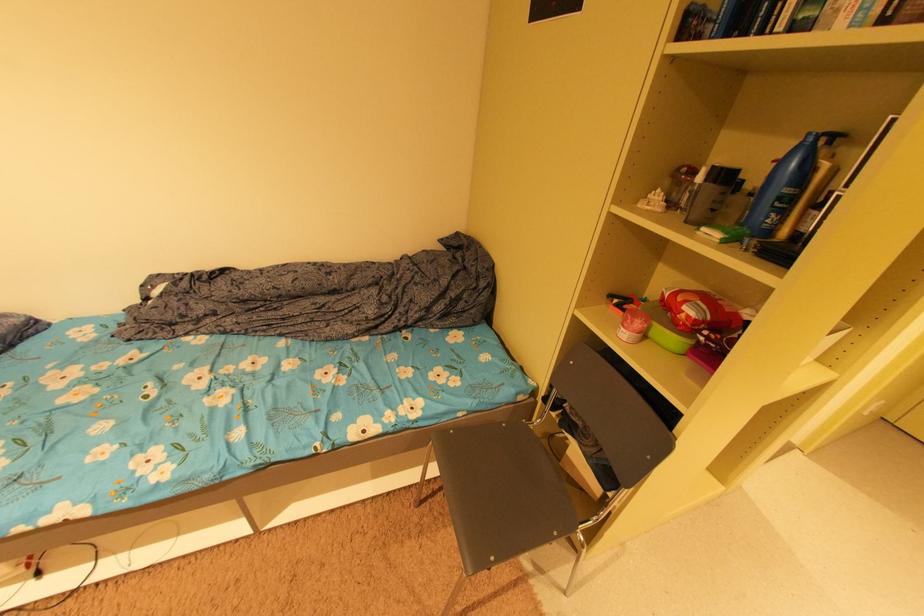
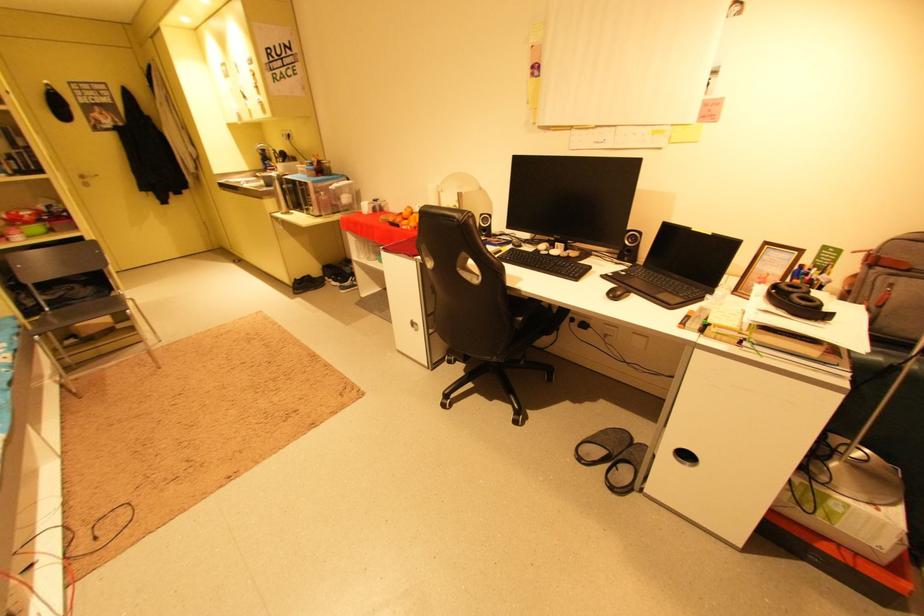
The point at (678, 339) is marked in the first image. Where is the corresponding point in the second image?

(43, 229)